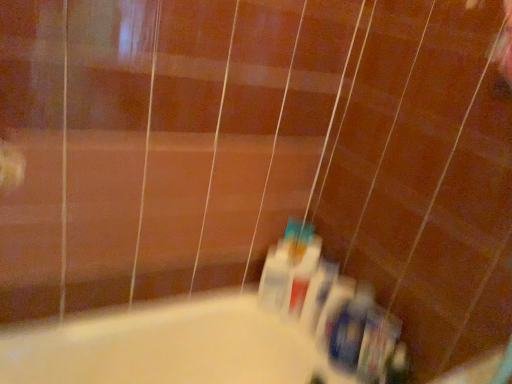
Question: Is white plastic mouthwash at lower center looking in the opposite direction of translucent plastic toothbrush at center, which is the third toiletry in left-to-right order?

Choices:
 (A) yes
 (B) no

Answer: (B)

Question: Would you say white plastic mouthwash at lower center is outside translucent plastic toothbrush at center, positioned as the 3th toiletry in right-to-left order?

Choices:
 (A) no
 (B) yes

Answer: (B)

Question: Considering the relative positions of white plastic mouthwash at lower center and translucent plastic toothbrush at center, positioned as the 3th toiletry in right-to-left order, in the image provided, is white plastic mouthwash at lower center to the left of translucent plastic toothbrush at center, positioned as the 3th toiletry in right-to-left order, from the viewer's perspective?

Choices:
 (A) no
 (B) yes

Answer: (B)

Question: Is white plastic mouthwash at lower center placed right next to translucent plastic toothbrush at center, positioned as the 3th toiletry in right-to-left order?

Choices:
 (A) yes
 (B) no

Answer: (A)

Question: Can you confirm if white plastic mouthwash at lower center is thinner than translucent plastic toothbrush at center, positioned as the 3th toiletry in right-to-left order?

Choices:
 (A) yes
 (B) no

Answer: (A)

Question: Does white plastic mouthwash at lower center have a greater width compared to translucent plastic toothbrush at center, positioned as the 3th toiletry in right-to-left order?

Choices:
 (A) no
 (B) yes

Answer: (A)

Question: Is the depth of white plastic mouthwash at lower center greater than that of white plastic toothpaste tube at center, which ranks as the 5th toiletry in right-to-left order?

Choices:
 (A) no
 (B) yes

Answer: (A)

Question: Does white plastic mouthwash at lower center have a greater height compared to white plastic toothpaste tube at center, which ranks as the 5th toiletry in right-to-left order?

Choices:
 (A) no
 (B) yes

Answer: (B)

Question: Considering the relative positions of white plastic mouthwash at lower center and white plastic toothpaste tube at center, arranged as the first toiletry when viewed from the left, in the image provided, is white plastic mouthwash at lower center to the left of white plastic toothpaste tube at center, arranged as the first toiletry when viewed from the left, from the viewer's perspective?

Choices:
 (A) no
 (B) yes

Answer: (A)

Question: Is white plastic mouthwash at lower center located outside white plastic toothpaste tube at center, which ranks as the 5th toiletry in right-to-left order?

Choices:
 (A) no
 (B) yes

Answer: (B)

Question: Is white plastic mouthwash at lower center thinner than white plastic toothpaste tube at center, arranged as the first toiletry when viewed from the left?

Choices:
 (A) yes
 (B) no

Answer: (A)

Question: Are white plastic mouthwash at lower center and white plastic toothpaste tube at center, which ranks as the 5th toiletry in right-to-left order, far apart?

Choices:
 (A) yes
 (B) no

Answer: (B)

Question: Is translucent plastic toothbrushes at lower center, the 4th toiletry viewed from the right, thinner than white plastic toothpaste tube at center, arranged as the first toiletry when viewed from the left?

Choices:
 (A) yes
 (B) no

Answer: (B)